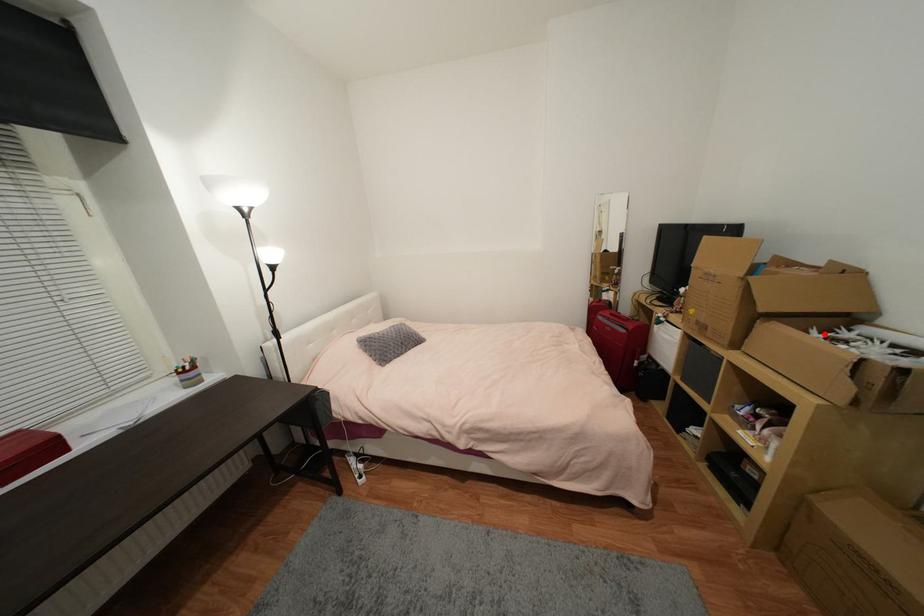
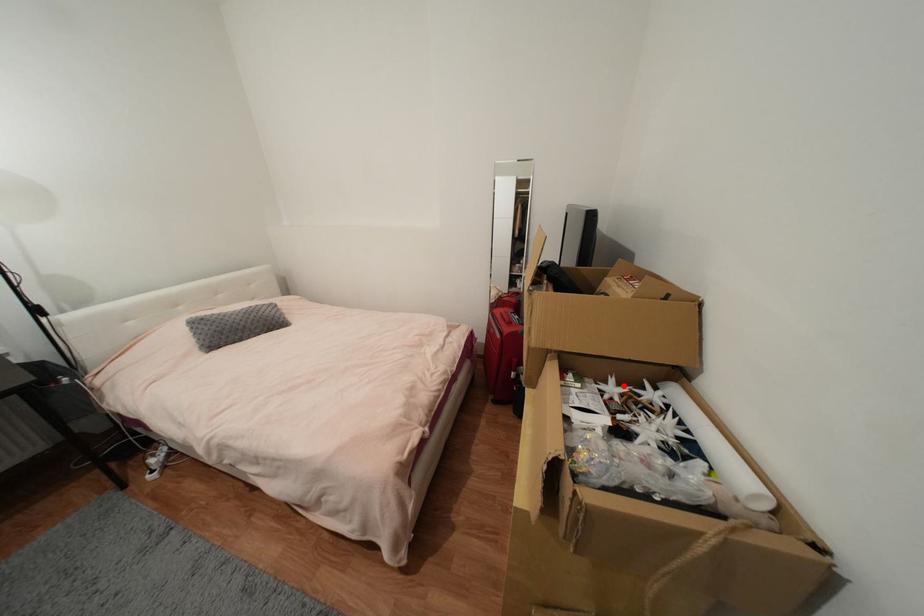
I am providing you with two images of the same scene from different viewpoints. A red point is marked on the first image and another point is marked on the second image. Does the point marked in image1 correspond to the same location as the one in image2?

Yes